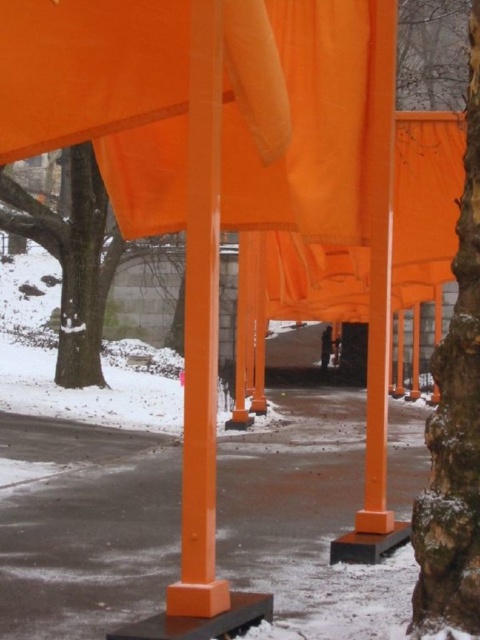
Question: Which point is closer to the camera?

Choices:
 (A) (445, 371)
 (B) (17, 221)

Answer: (A)

Question: Is smooth bark tree at right behind smooth bark tree at lower left?

Choices:
 (A) yes
 (B) no

Answer: (B)

Question: Which point is farther to the camera?

Choices:
 (A) tap(416, 545)
 (B) tap(93, 200)

Answer: (B)

Question: From the image, what is the correct spatial relationship of smooth bark tree at right in relation to smooth bark tree at lower left?

Choices:
 (A) below
 (B) above

Answer: (A)

Question: Is smooth bark tree at right closer to camera compared to smooth bark tree at lower left?

Choices:
 (A) no
 (B) yes

Answer: (B)

Question: Which of the following is the farthest from the observer?

Choices:
 (A) smooth bark tree at lower left
 (B) smooth bark tree at right

Answer: (A)